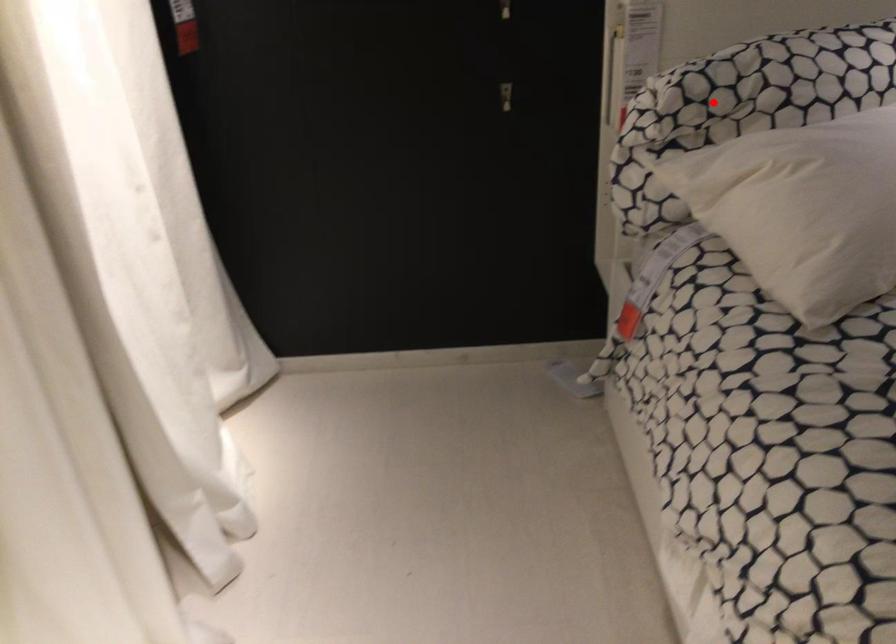
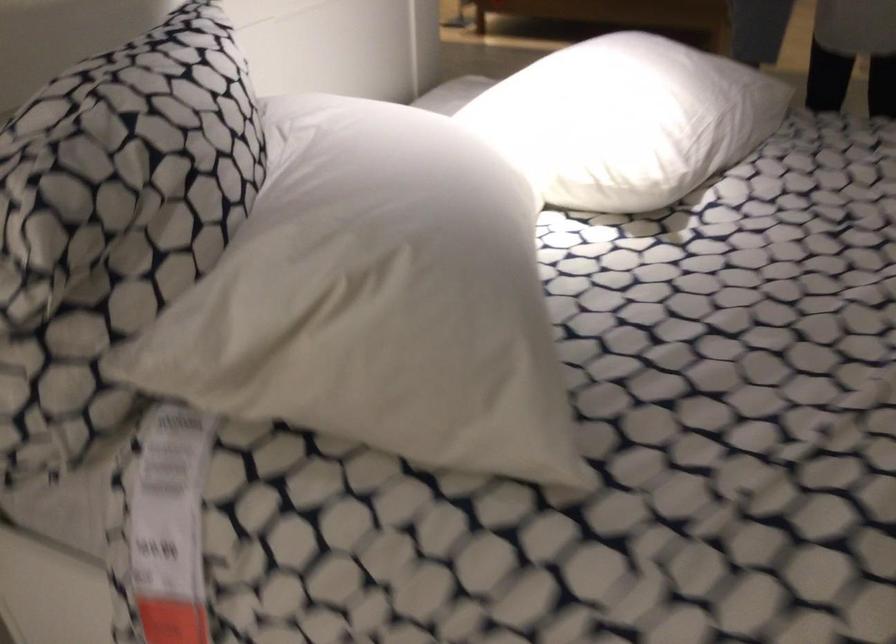
Question: I am providing you with two images of the same scene from different viewpoints. Given a red point in image1, look at the same physical point in image2. Is it:

Choices:
 (A) Closer to the viewpoint
 (B) Farther from the viewpoint

Answer: (A)